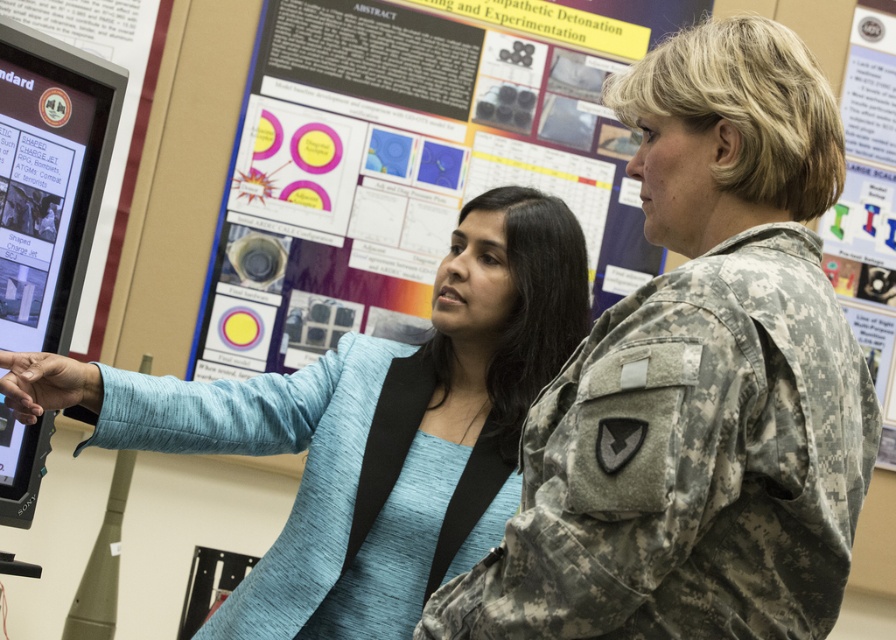
You are an attendee at this event and want to take a photo of the matte paper poster at center without the blue fabric jacket at center blocking it. Where should you move to achieve this?

The blue fabric jacket at center is behind the matte paper poster at center, so moving to the side of the matte paper poster at center would allow you to take a photo without the jacket blocking the view.

You are organizing a conference and need to place a new banner between the matte paper poster at center and the matte black monitor at left. Which object should the banner be placed closer to if it needs to be larger than both?

The banner should be placed closer to the matte paper poster at center because it is larger than the matte black monitor at left, allowing the banner to be positioned to accommodate its size requirement.